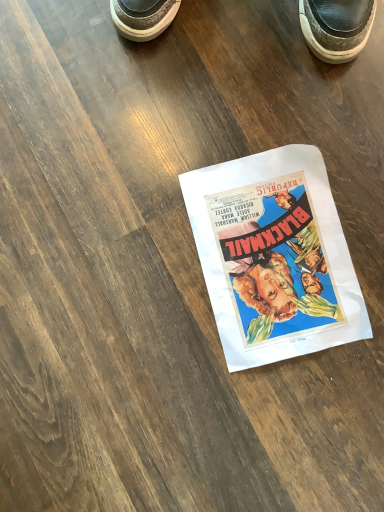
Where is `matte paper poster at center`? Image resolution: width=384 pixels, height=512 pixels. matte paper poster at center is located at coordinates (274, 256).

The height and width of the screenshot is (512, 384). Describe the element at coordinates (274, 256) in the screenshot. I see `matte paper poster at center` at that location.

Identify the location of matte paper poster at center. The image size is (384, 512). (274, 256).